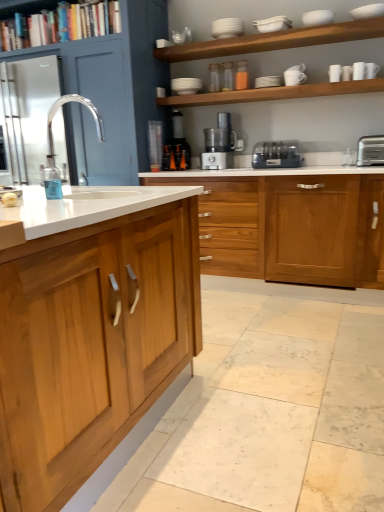
Question: From the image's perspective, is wooden cabinet at center, marked as the 1th cabinetry in a back-to-front arrangement, above white glossy shelves at upper center, the third shelf viewed from the top?

Choices:
 (A) no
 (B) yes

Answer: (B)

Question: Considering the relative sizes of wooden cabinet at center, marked as the 1th cabinetry in a back-to-front arrangement, and white glossy shelves at upper center, the 1th shelf in the bottom-to-top sequence, in the image provided, is wooden cabinet at center, marked as the 1th cabinetry in a back-to-front arrangement, smaller than white glossy shelves at upper center, the 1th shelf in the bottom-to-top sequence,?

Choices:
 (A) no
 (B) yes

Answer: (A)

Question: Does wooden cabinet at center, which is the 3th cabinetry from front to back, touch white glossy shelves at upper center, the third shelf viewed from the top?

Choices:
 (A) no
 (B) yes

Answer: (A)

Question: Does wooden cabinet at center, which is the 3th cabinetry from front to back, have a larger size compared to white glossy shelves at upper center, the third shelf viewed from the top?

Choices:
 (A) yes
 (B) no

Answer: (A)

Question: Is wooden cabinet at center, marked as the 1th cabinetry in a back-to-front arrangement, closer to the viewer compared to white glossy shelves at upper center, the third shelf viewed from the top?

Choices:
 (A) yes
 (B) no

Answer: (B)

Question: Relative to clear glass faucet at center, is white matte shelves at upper center, placed as the 2th shelf when sorted from bottom to top, in front or behind?

Choices:
 (A) front
 (B) behind

Answer: (B)

Question: Visually, is white matte shelves at upper center, placed as the 2th shelf when sorted from bottom to top, positioned to the left or to the right of clear glass faucet at center?

Choices:
 (A) right
 (B) left

Answer: (A)

Question: Is white matte shelves at upper center, placed as the 2th shelf when sorted from bottom to top, taller or shorter than clear glass faucet at center?

Choices:
 (A) short
 (B) tall

Answer: (A)

Question: Is white matte shelves at upper center, the 2th shelf when ordered from top to bottom, wider or thinner than clear glass faucet at center?

Choices:
 (A) thin
 (B) wide

Answer: (B)

Question: Based on their sizes in the image, would you say satin silver metallic food processor at center, which is the 2th home appliance from right to left, is bigger or smaller than wooden cabinet at center, which is the 3th cabinetry from front to back?

Choices:
 (A) big
 (B) small

Answer: (B)

Question: In terms of height, does satin silver metallic food processor at center, marked as the first home appliance in a left-to-right arrangement, look taller or shorter compared to wooden cabinet at center, which is the 3th cabinetry from front to back?

Choices:
 (A) short
 (B) tall

Answer: (A)

Question: Is point (216, 155) closer or farther from the camera than point (144, 142)?

Choices:
 (A) farther
 (B) closer

Answer: (A)

Question: Is satin silver metallic food processor at center, marked as the first home appliance in a left-to-right arrangement, inside or outside of wooden cabinet at center, marked as the 1th cabinetry in a back-to-front arrangement?

Choices:
 (A) outside
 (B) inside

Answer: (A)

Question: Is clear glass faucet at center in front of or behind satin black toaster at center, positioned as the 1th home appliance in right-to-left order, in the image?

Choices:
 (A) behind
 (B) front

Answer: (B)

Question: From a real-world perspective, is clear glass faucet at center positioned above or below satin black toaster at center, positioned as the 1th home appliance in right-to-left order?

Choices:
 (A) above
 (B) below

Answer: (A)